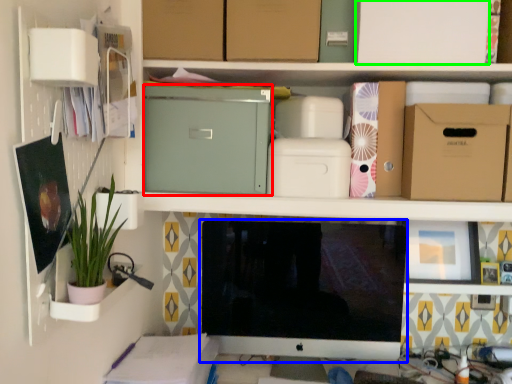
Question: Which is nearer to the cardboard box (highlighted by a red box)? computer monitor (highlighted by a blue box) or cardboard box (highlighted by a green box).

Choices:
 (A) computer monitor
 (B) cardboard box

Answer: (A)